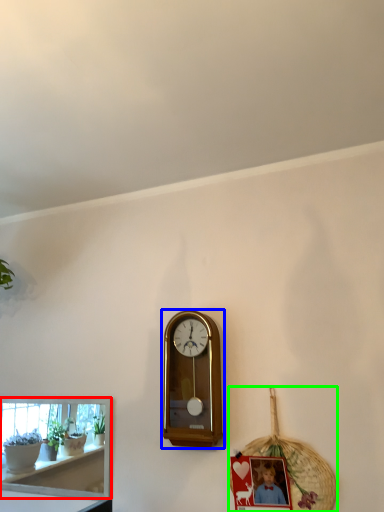
Question: Considering the real-world distances, which object is farthest from shelf (highlighted by a red box)? wall clock (highlighted by a blue box) or basket (highlighted by a green box)?

Choices:
 (A) wall clock
 (B) basket

Answer: (B)